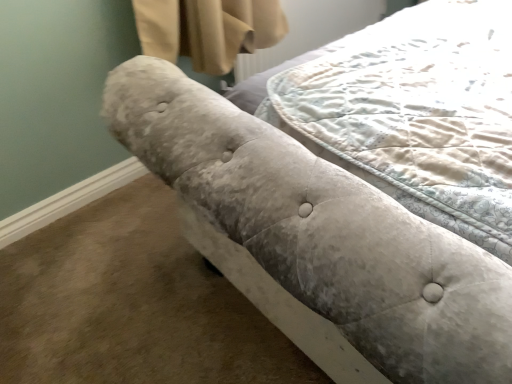
In order to face velvet quilted sheet at center, should I rotate leftwards or rightwards?

To face it directly, rotate right by 26.131 degrees.

The image size is (512, 384). What do you see at coordinates (415, 112) in the screenshot? I see `velvet quilted sheet at center` at bounding box center [415, 112].

I want to click on velvet quilted sheet at center, so click(x=415, y=112).

What is the approximate width of velvet quilted sheet at center?

It is 36.68 inches.

This screenshot has width=512, height=384. What are the coordinates of `velvet quilted sheet at center` in the screenshot? It's located at (415, 112).